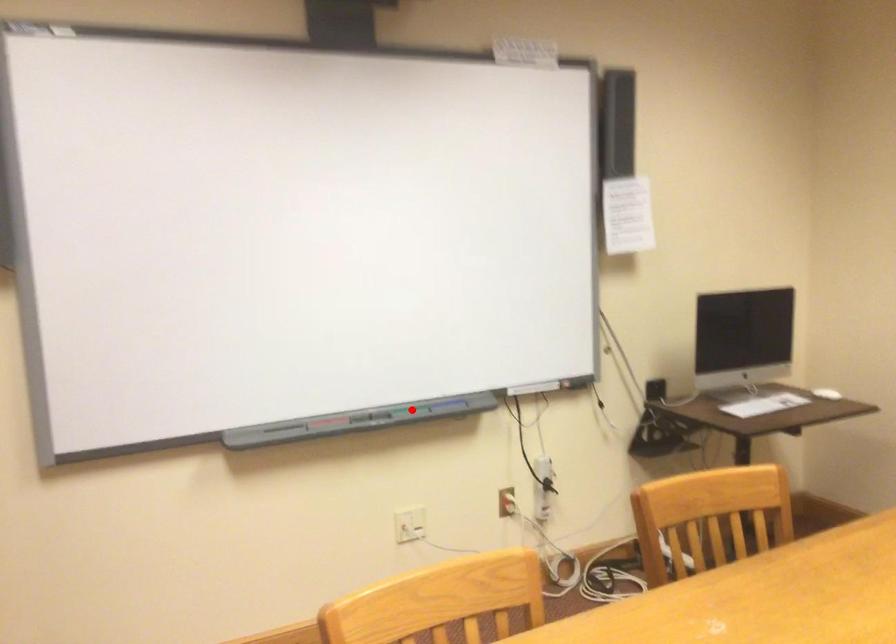
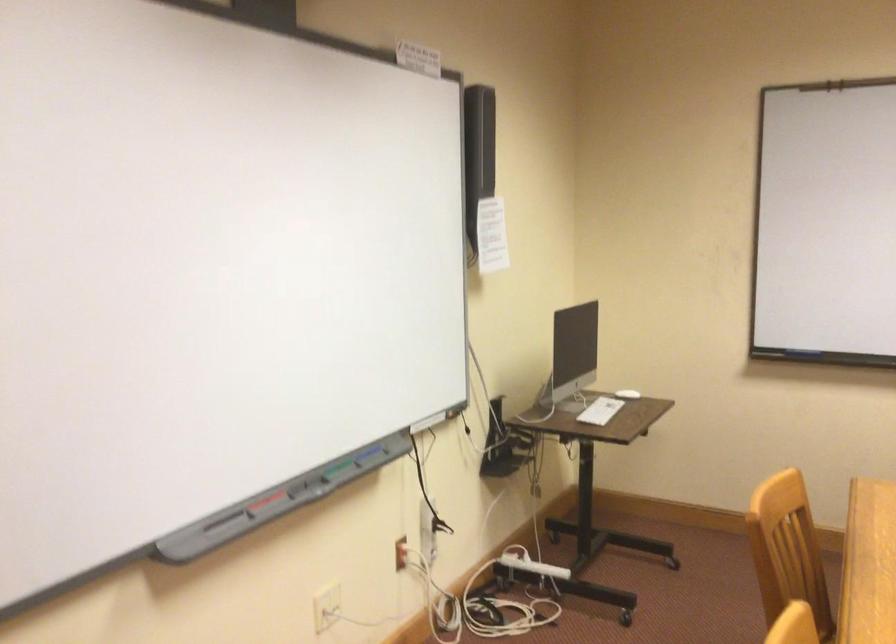
Question: A red point is marked in image1. In image2, is the corresponding 3D point closer to the camera or farther? Reply with the corresponding letter.

Choices:
 (A) The corresponding 3D point is closer.
 (B) The corresponding 3D point is farther.

Answer: (A)